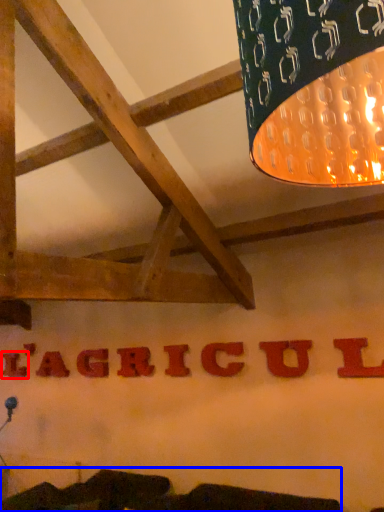
Question: Which object appears farthest to the camera in this image, letter (highlighted by a red box) or furniture (highlighted by a blue box)?

Choices:
 (A) letter
 (B) furniture

Answer: (A)